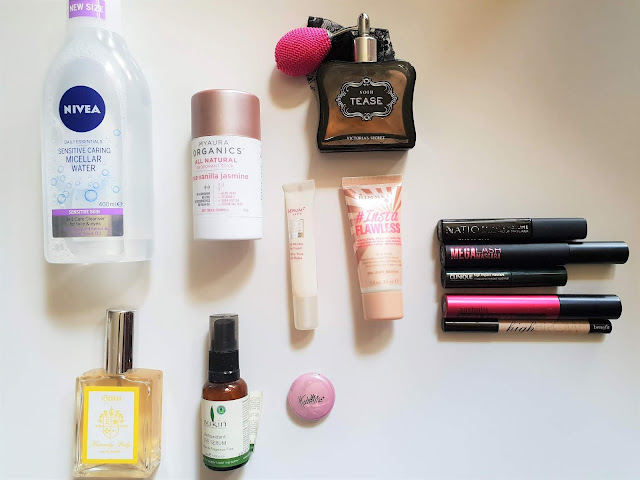
The height and width of the screenshot is (480, 640). Find the location of `perfume'`. perfume' is located at coordinates (132, 444).